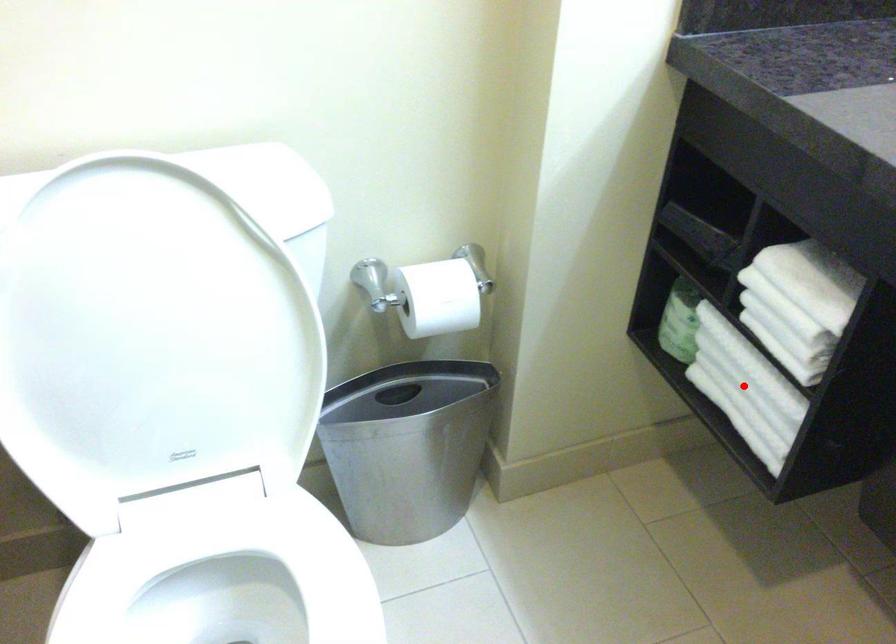
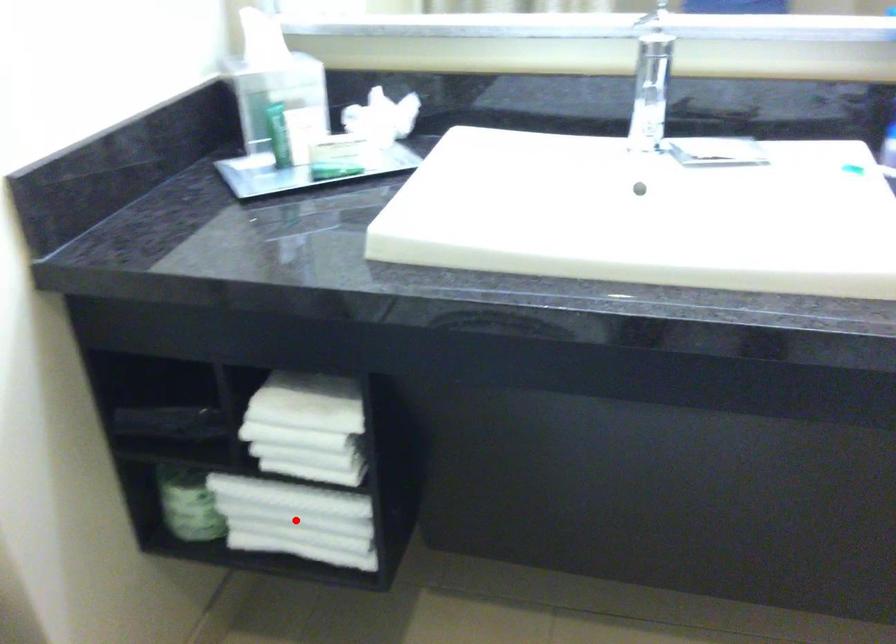
I am providing you with two images of the same scene from different viewpoints. A red point is marked on the first image and another point is marked on the second image. Are the points marked in image1 and image2 representing the same 3D position?

Yes